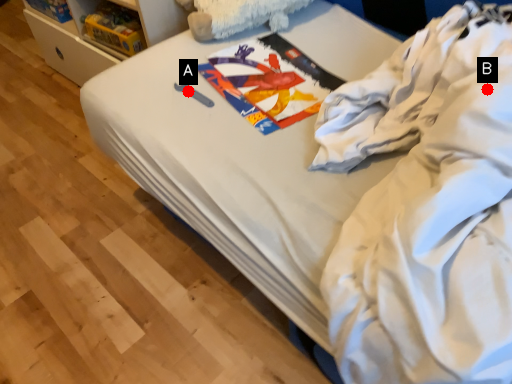
Question: Two points are circled on the image, labeled by A and B beside each circle. Which of the following is the farthest from the observer?

Choices:
 (A) A is further
 (B) B is further

Answer: (A)